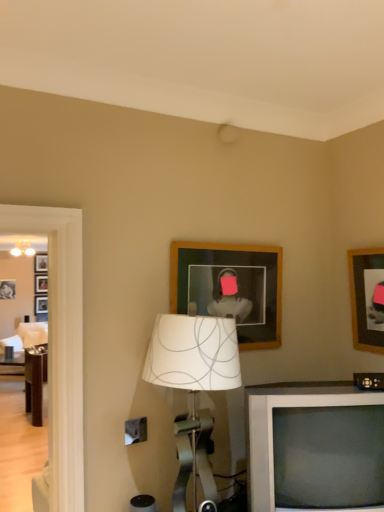
Question: From a real-world perspective, is wooden picture frame at upper right, arranged as the first picture frame when viewed from the right, above or below white fabric lampshade at center?

Choices:
 (A) above
 (B) below

Answer: (A)

Question: Is wooden picture frame at upper right, arranged as the second picture frame when viewed from the left, bigger or smaller than white fabric lampshade at center?

Choices:
 (A) big
 (B) small

Answer: (B)

Question: Considering the real-world distances, which object is farthest from the white fabric lampshade at center?

Choices:
 (A) wooden picture frame at upper right, arranged as the first picture frame when viewed from the right
 (B) wooden picture frame at upper center, positioned as the 2th picture frame in right-to-left order
 (C) white plastic television at lower right

Answer: (A)

Question: Considering the real-world distances, which object is closest to the wooden picture frame at upper right, arranged as the second picture frame when viewed from the left?

Choices:
 (A) white fabric lampshade at center
 (B) wooden picture frame at upper center, positioned as the 2th picture frame in right-to-left order
 (C) white plastic television at lower right

Answer: (B)